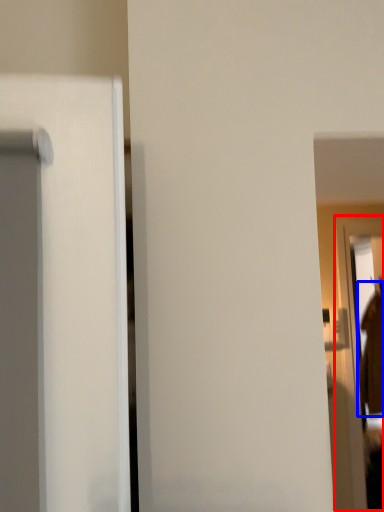
Question: Which object appears closest to the camera in this image, screen door (highlighted by a red box) or robe (highlighted by a blue box)?

Choices:
 (A) screen door
 (B) robe

Answer: (A)